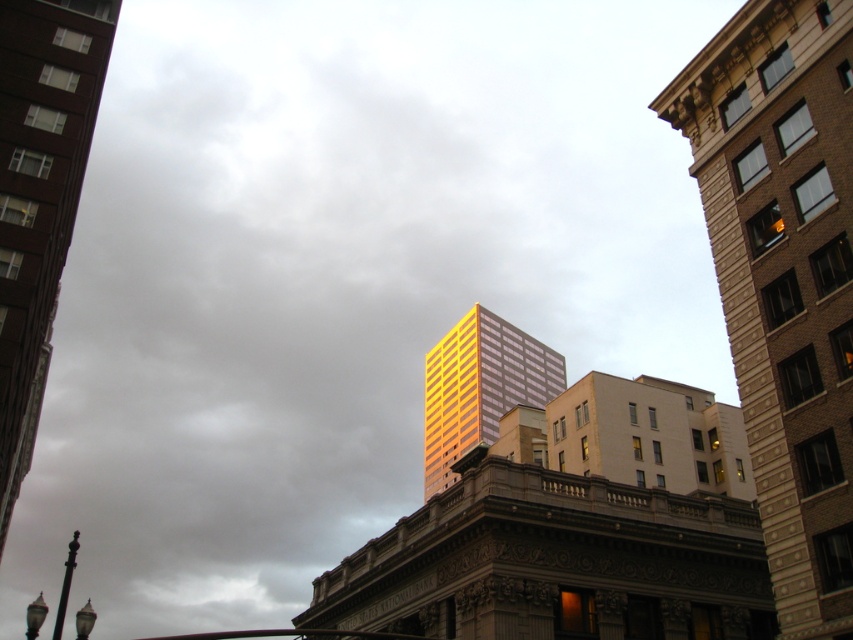
Question: Which object is the closest to the gold glass skyscraper at center?

Choices:
 (A) gold reflective glass building at center
 (B) gold reflective glass skyscraper at center

Answer: (B)

Question: Is gold glass skyscraper at center positioned in front of gold reflective glass building at center?

Choices:
 (A) yes
 (B) no

Answer: (A)

Question: Which point is farther from the camera taking this photo?

Choices:
 (A) (33, 35)
 (B) (769, 17)
 (C) (505, 324)

Answer: (C)

Question: Does gold glass skyscraper at center appear on the left side of gold reflective glass skyscraper at center?

Choices:
 (A) yes
 (B) no

Answer: (B)

Question: Which of the following is the closest to the observer?

Choices:
 (A) (466, 406)
 (B) (25, 173)

Answer: (B)

Question: Is gold glass skyscraper at center above gold reflective glass skyscraper at center?

Choices:
 (A) no
 (B) yes

Answer: (B)